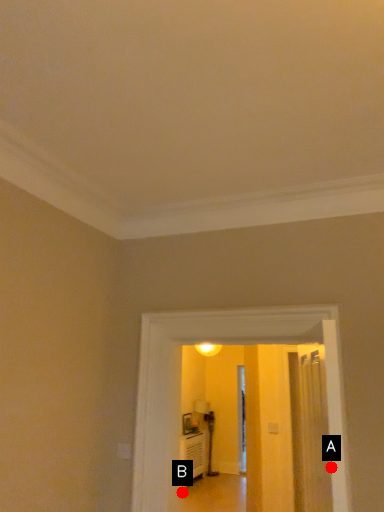
Question: Two points are circled on the image, labeled by A and B beside each circle. Which point is closer to the camera?

Choices:
 (A) A is closer
 (B) B is closer

Answer: (A)